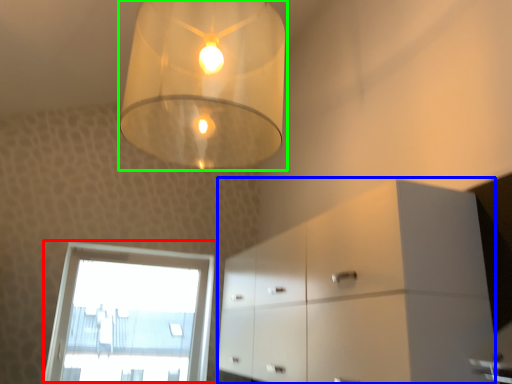
Question: Considering the real-world distances, which object is closest to window (highlighted by a red box)? dresser (highlighted by a blue box) or lamp (highlighted by a green box).

Choices:
 (A) dresser
 (B) lamp

Answer: (A)